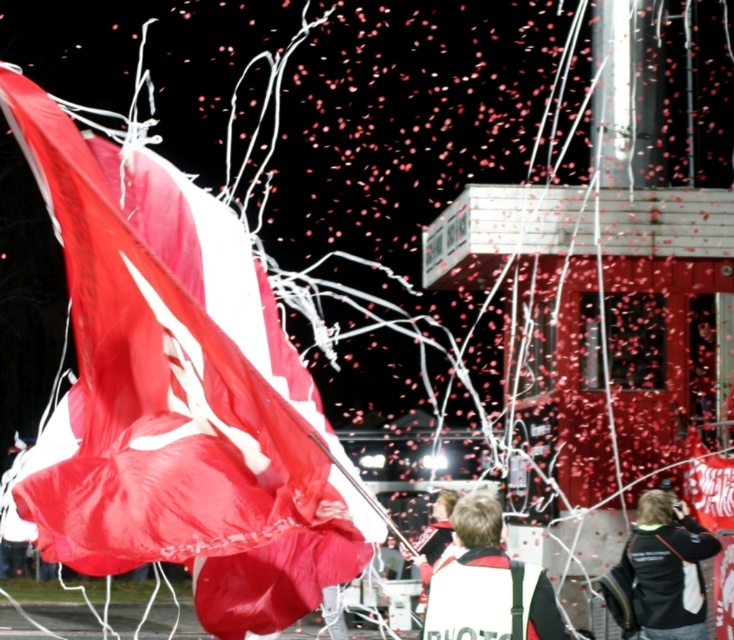
Question: Where is matte red flag at left located in relation to white fabric vest at center in the image?

Choices:
 (A) right
 (B) left

Answer: (B)

Question: Estimate the real-world distances between objects in this image. Which object is closer to the matte red flag at left?

Choices:
 (A) white fabric vest at center
 (B) black fabric jacket at lower right

Answer: (A)

Question: Estimate the real-world distances between objects in this image. Which object is closer to the matte red flag at left?

Choices:
 (A) black fabric jacket at lower right
 (B) white fabric vest at center

Answer: (B)

Question: Which of the following is the closest to the observer?

Choices:
 (A) white fabric vest at center
 (B) matte red flag at left

Answer: (B)

Question: Can you confirm if matte red flag at left is bigger than white fabric vest at center?

Choices:
 (A) no
 (B) yes

Answer: (B)

Question: From the image, what is the correct spatial relationship of matte red flag at left in relation to black fabric jacket at lower right?

Choices:
 (A) above
 (B) below

Answer: (A)